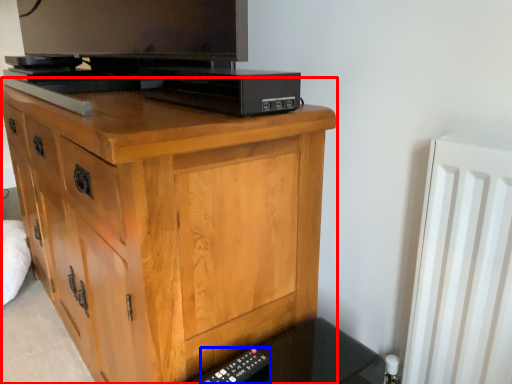
Question: Among these objects, which one is nearest to the camera, chest of drawers (highlighted by a red box) or remote (highlighted by a blue box)?

Choices:
 (A) chest of drawers
 (B) remote

Answer: (A)